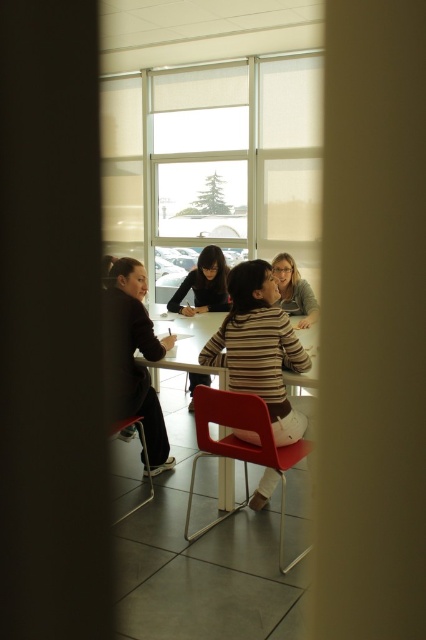
You are organizing a small workshop and need to seat two participants. You have a matte plastic chair at center and a matte plastic chair at lower left. If you want to choose the more spacious seating option for someone who prefers more legroom, which chair should you select?

The matte plastic chair at center is larger in size than the matte plastic chair at lower left, so you should select the matte plastic chair at center for more legroom.

From the picture: You are standing at the center of the room and want to pick up an object located at point [204,284]. What object is at that location?

The object at point [204,284] is the matte black shirt at center.

You are a new employee attending a meeting in this office. You need to place your laptop on the table. Considering the size of the striped fabric shirt at center and the white glossy table at center, will there be enough space for your laptop?

The striped fabric shirt at center has a smaller size compared to the white glossy table at center, so there should be enough space on the white glossy table at center to place your laptop.